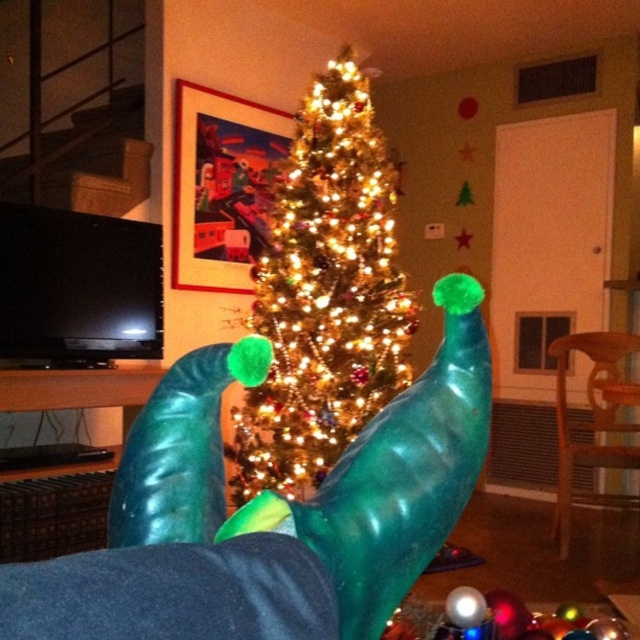
Can you confirm if green rubber socks at center is smaller than iridescent shiny tree at center?

Indeed, green rubber socks at center has a smaller size compared to iridescent shiny tree at center.

Is green rubber socks at center above iridescent shiny tree at center?

Actually, green rubber socks at center is below iridescent shiny tree at center.

Locate an element on the screen. green rubber socks at center is located at coordinates (269, 515).